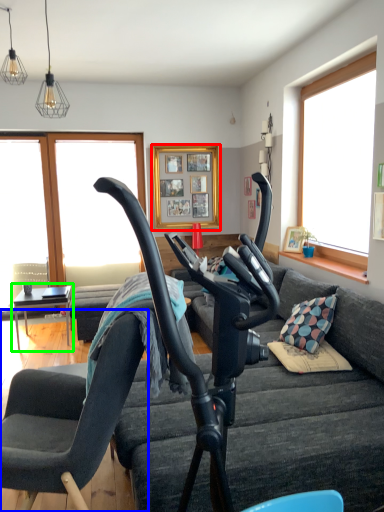
Question: Which is nearer to the picture frame (highlighted by a red box)? chair (highlighted by a blue box) or table (highlighted by a green box).

Choices:
 (A) chair
 (B) table

Answer: (B)